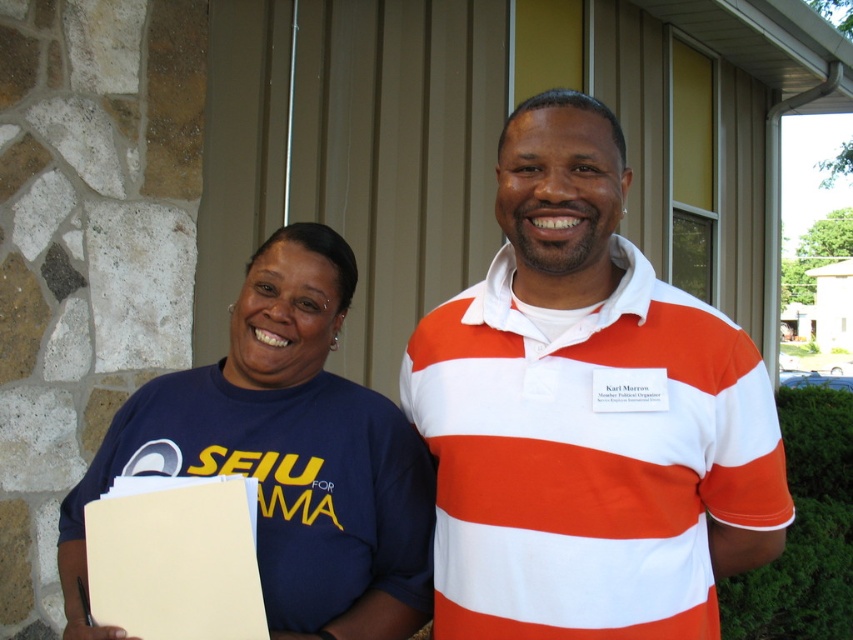
Looking at this image, please describe the position of the white striped polo shirt at center in terms of its coordinates within the image frame. Use the coordinate system where the bottom left corner is the origin point.

The white striped polo shirt at center is located at coordinates approximately 0.648 along the horizontal axis and 0.689 along the vertical axis within the image frame.

You are a photographer standing at a distance. You want to take a closeup shot of the white striped polo shirt at center. Considering the distance, is it possible to capture the shirt clearly without moving closer?

The white striped polo shirt at center is 4.26 feet away from the camera. A standard camera lens can capture clear closeup shots from this distance, so yes, it is possible to take a clear photo without moving closer.